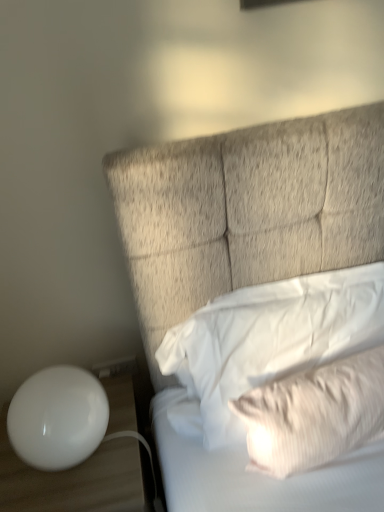
Question: Is white plastic electric outlet at lower left positioned before white glossy table at lower left?

Choices:
 (A) yes
 (B) no

Answer: (B)

Question: Is white plastic electric outlet at lower left oriented away from white glossy table at lower left?

Choices:
 (A) yes
 (B) no

Answer: (B)

Question: Is white plastic electric outlet at lower left aimed at white glossy table at lower left?

Choices:
 (A) yes
 (B) no

Answer: (A)

Question: Is white plastic electric outlet at lower left to the left of white glossy table at lower left from the viewer's perspective?

Choices:
 (A) no
 (B) yes

Answer: (A)

Question: Would you say white plastic electric outlet at lower left is a long distance from white glossy table at lower left?

Choices:
 (A) no
 (B) yes

Answer: (A)

Question: From a real-world perspective, is white plastic electric outlet at lower left positioned above or below white glossy sphere at lower left?

Choices:
 (A) below
 (B) above

Answer: (A)

Question: In terms of width, does white plastic electric outlet at lower left look wider or thinner when compared to white glossy sphere at lower left?

Choices:
 (A) thin
 (B) wide

Answer: (A)

Question: From the image's perspective, is white plastic electric outlet at lower left above or below white glossy sphere at lower left?

Choices:
 (A) above
 (B) below

Answer: (A)

Question: In the image, is white plastic electric outlet at lower left on the left side or the right side of white glossy sphere at lower left?

Choices:
 (A) left
 (B) right

Answer: (B)

Question: From a real-world perspective, is white glossy sphere at lower left positioned above or below white plastic electric outlet at lower left?

Choices:
 (A) below
 (B) above

Answer: (B)

Question: From the image's perspective, is white glossy sphere at lower left positioned above or below white plastic electric outlet at lower left?

Choices:
 (A) below
 (B) above

Answer: (A)

Question: Is white glossy sphere at lower left to the left or to the right of white plastic electric outlet at lower left in the image?

Choices:
 (A) right
 (B) left

Answer: (B)

Question: Considering the positions of white glossy sphere at lower left and white plastic electric outlet at lower left in the image, is white glossy sphere at lower left wider or thinner than white plastic electric outlet at lower left?

Choices:
 (A) wide
 (B) thin

Answer: (A)

Question: Would you say white glossy sphere at lower left is to the left or to the right of white glossy table at lower left in the picture?

Choices:
 (A) left
 (B) right

Answer: (A)

Question: Considering the positions of white glossy sphere at lower left and white glossy table at lower left in the image, is white glossy sphere at lower left bigger or smaller than white glossy table at lower left?

Choices:
 (A) big
 (B) small

Answer: (B)